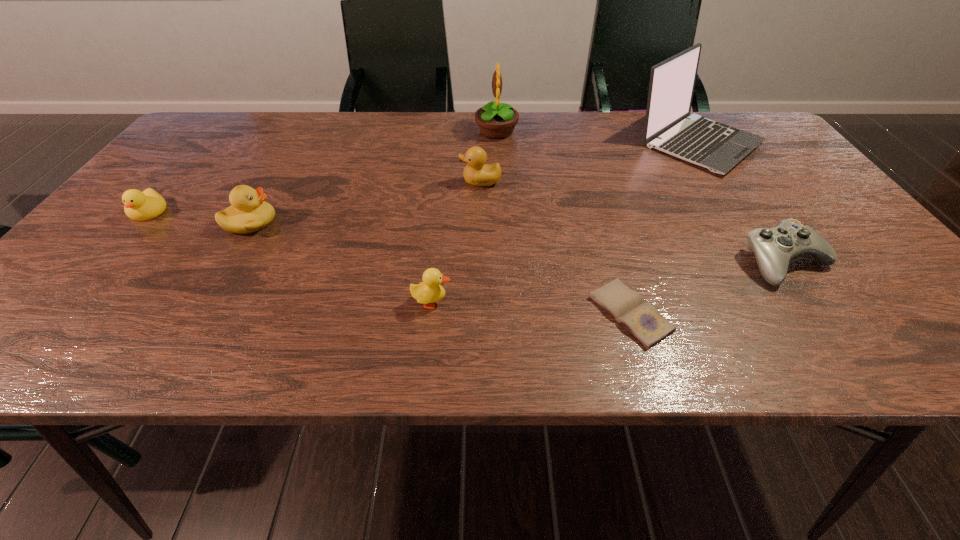
Locate an element on the screen. free location that satisfies the following two spatial constraints: 1. on the face of the shortest object; 2. on the left side of the sunflower is located at coordinates (506, 314).